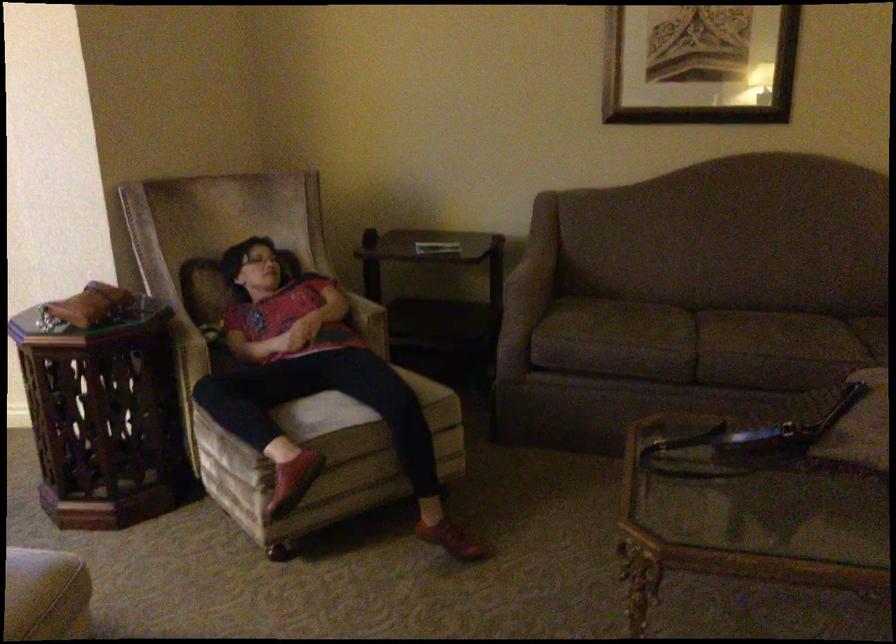
Describe the element at coordinates (195, 344) in the screenshot. I see `the chair armrest` at that location.